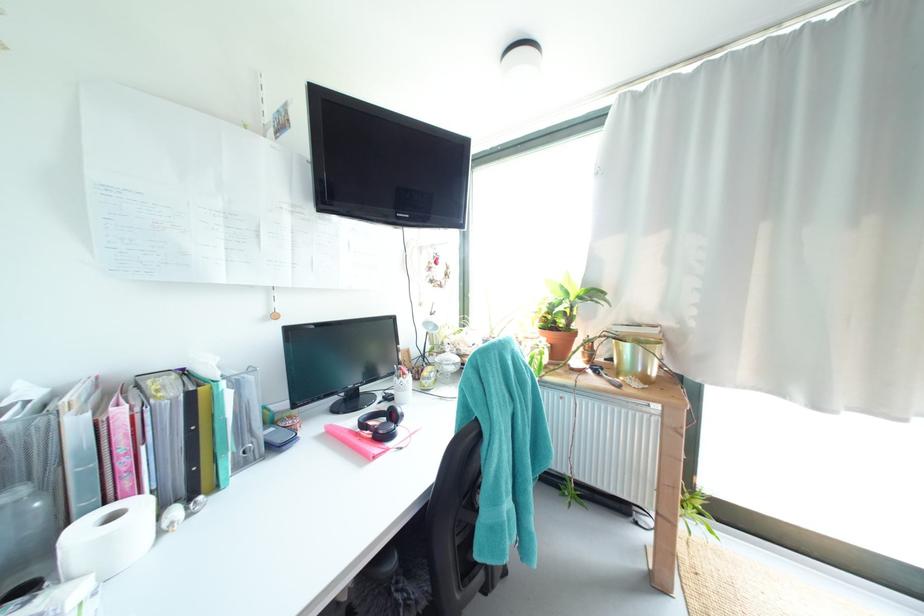
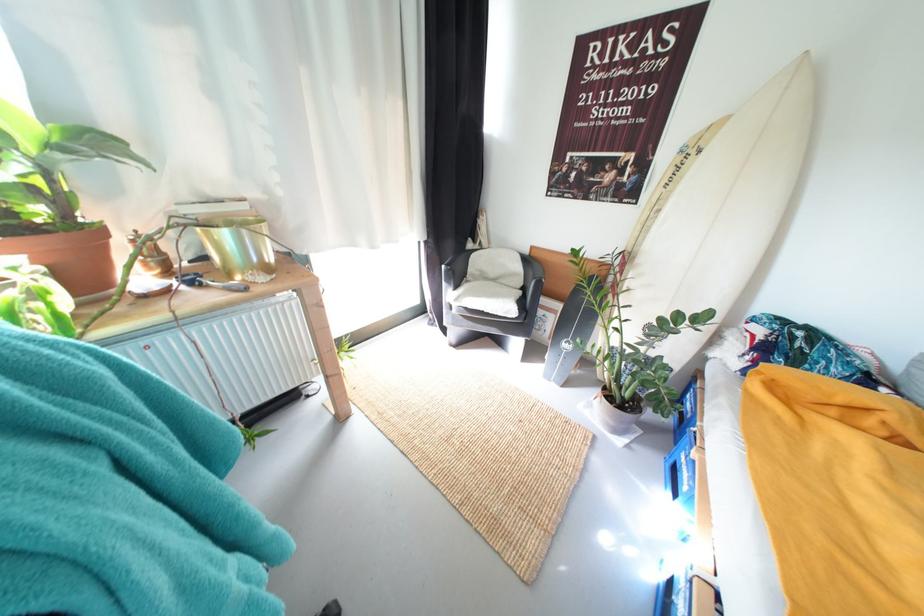
First-person continuous shooting, in which direction is the camera rotating?

The rotation direction of the camera is right-down.